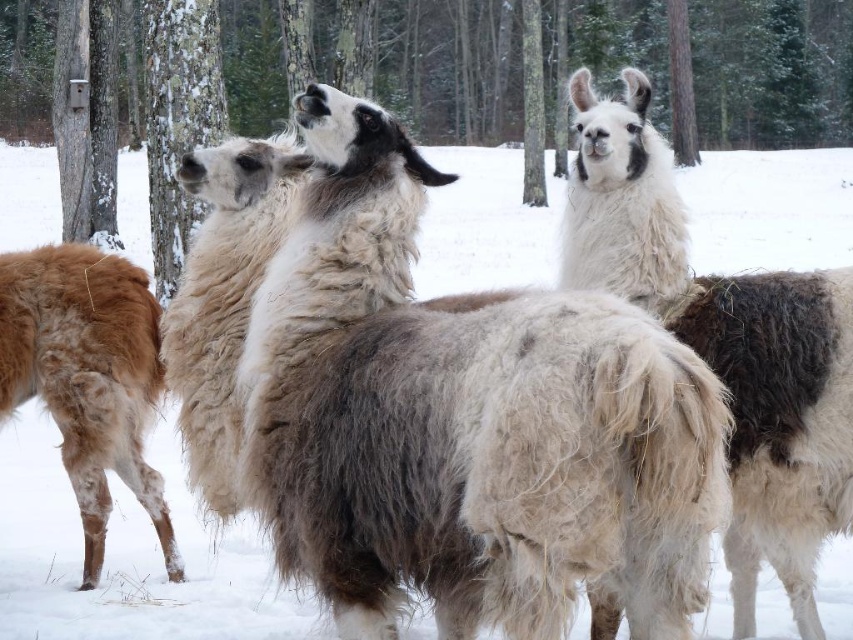
Question: Is the position of fuzzy white alpaca at center less distant than that of rough bark tree at center?

Choices:
 (A) no
 (B) yes

Answer: (B)

Question: Which point is closer to the camera?

Choices:
 (A) (717, 464)
 (B) (126, 348)

Answer: (A)

Question: Which point is farther from the camera taking this photo?

Choices:
 (A) (815, 528)
 (B) (122, 108)
 (C) (78, 288)
 (D) (387, 276)

Answer: (B)

Question: Is white woolly alpaca at center to the right of brown woolen alpaca at left from the viewer's perspective?

Choices:
 (A) yes
 (B) no

Answer: (A)

Question: Which object is positioned closest to the brown woolen alpaca at left?

Choices:
 (A) fuzzy white alpaca at center
 (B) white woolly alpaca at center

Answer: (A)

Question: Does fuzzy white alpaca at center appear over white woolly alpaca at center?

Choices:
 (A) yes
 (B) no

Answer: (A)